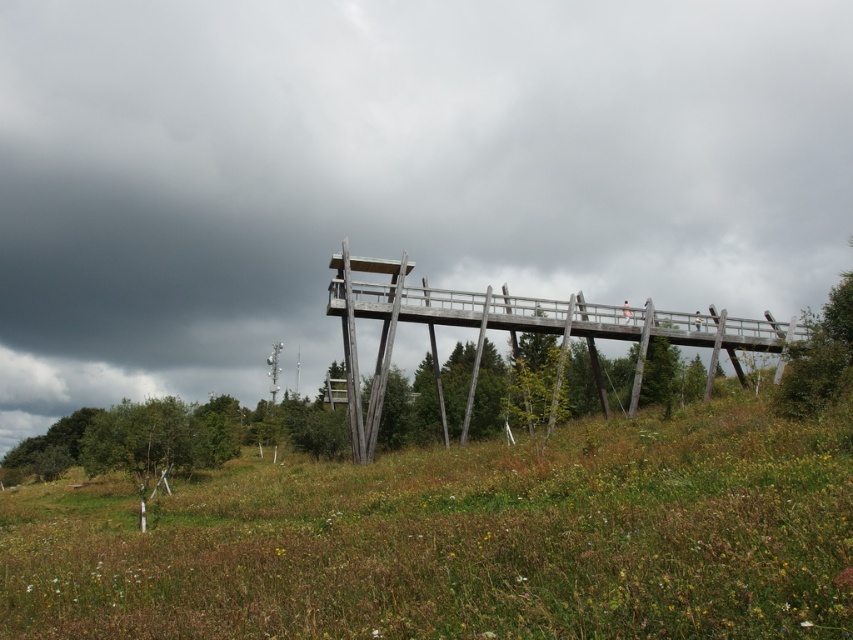
You are standing on the wooden observation platform and looking out into the scene. Which object, the gray cloudy sky at upper center or the green grassy at center, appears wider from your perspective?

The gray cloudy sky at upper center appears wider than the green grassy at center because its width surpasses the latter.